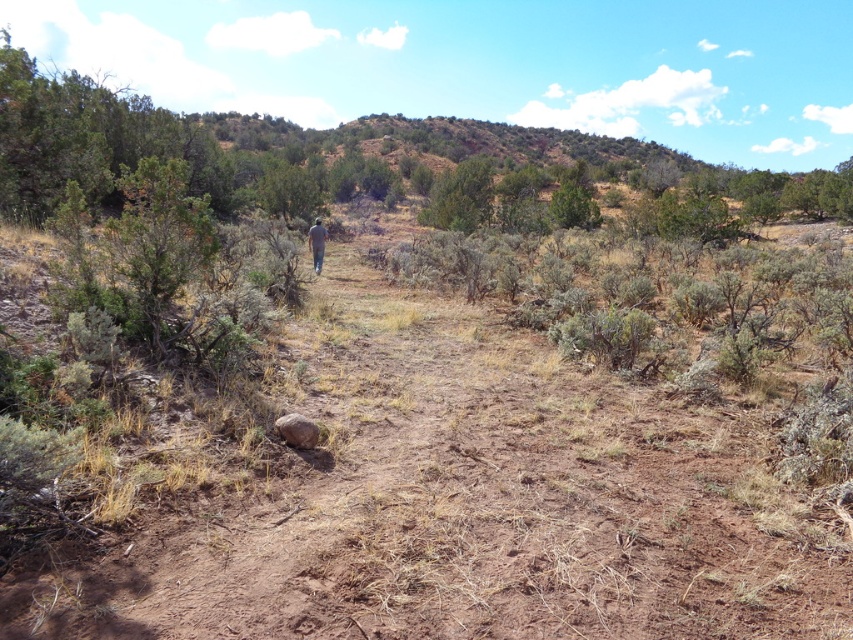
You are a hiker with a pair of gray fabric pants at center. You come across a brown dirt track at center in this dry, arid landscape. Can your pants fit entirely within the dirt track without any part hanging off?

The brown dirt track at center is wider than the gray fabric pants at center, so yes, the gray fabric pants at center can fit entirely within the dirt track without any part hanging off.

You are a hiker trying to navigate through the dry, arid landscape. You notice a brown dirt track at center and gray fabric pants at center. Which path should you choose to ensure you have enough space to walk comfortably?

The brown dirt track at center has a larger size compared to gray fabric pants at center, so you should choose the brown dirt track at center for more space to walk comfortably.

You are a hiker navigating the dry, arid landscape shown in the image. You see a brown dirt track at center and gray fabric pants at center. Which object is located to the right of the other?

The brown dirt track at center is positioned on the right side of gray fabric pants at center, so the dirt track is to the right of the gray fabric pants.